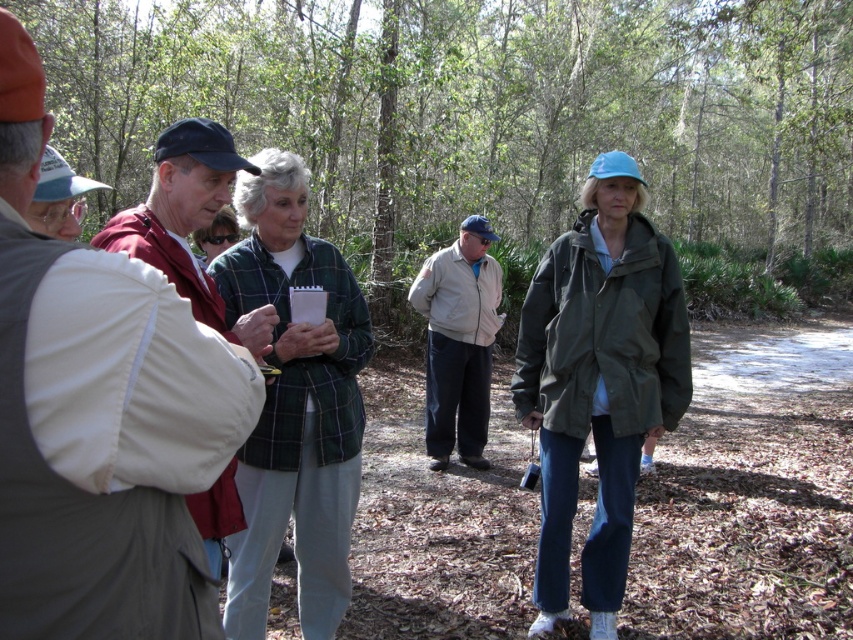
From the picture: Does green leafy tree at center appear on the left side of light beige jacket at center?

No, green leafy tree at center is not to the left of light beige jacket at center.

Between green leafy tree at center and light beige jacket at center, which one is positioned higher?

green leafy tree at center is higher up.

Find the location of a particular element. Image resolution: width=853 pixels, height=640 pixels. green leafy tree at center is located at coordinates (488, 115).

Who is more forward, (183, 99) or (259, 467)?

Point (259, 467)

What do you see at coordinates (488, 115) in the screenshot? I see `green leafy tree at center` at bounding box center [488, 115].

I want to click on green leafy tree at center, so click(488, 115).

Is olive-green fabric jacket at center-right bigger than green plaid shirt at center?

Yes.

Does olive-green fabric jacket at center-right lie behind green plaid shirt at center?

Yes, it is behind green plaid shirt at center.

Image resolution: width=853 pixels, height=640 pixels. In order to click on olive-green fabric jacket at center-right in this screenshot , I will do 598,381.